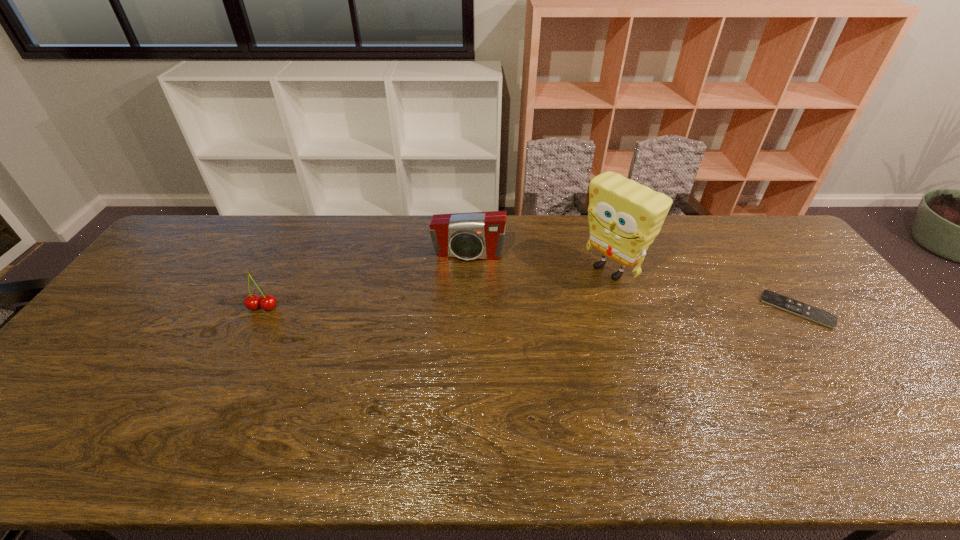
Find the location of `free space on the desktop that is between the leftmost object and the remote control and is positioned on the front-facing side of the camera`. free space on the desktop that is between the leftmost object and the remote control and is positioned on the front-facing side of the camera is located at coordinates (459, 308).

Identify the location of free spot on the desktop that is between the leftmost object and the remote control and is positioned on the face of the sponge. (556, 308).